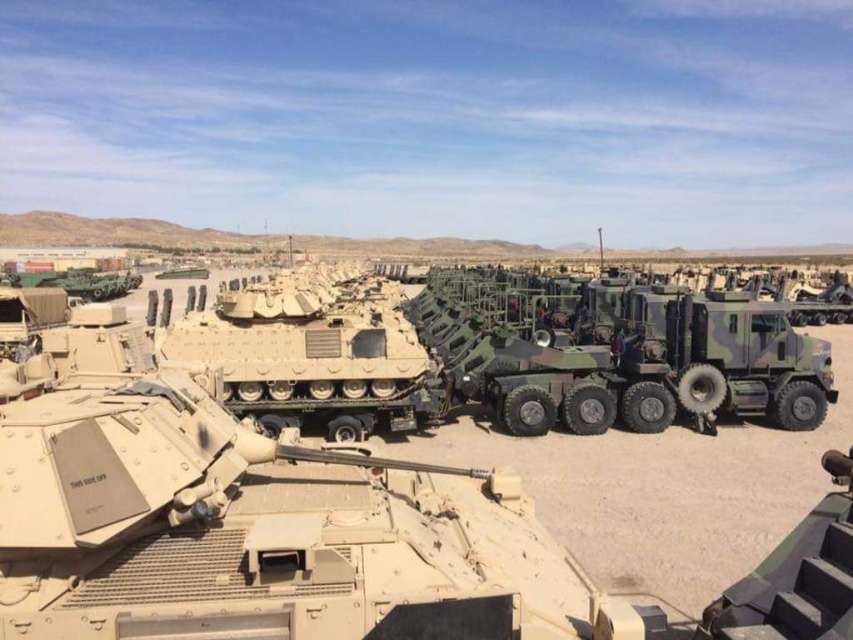
Question: Does tan matte tank at center appear over camouflage textured tank at center?

Choices:
 (A) yes
 (B) no

Answer: (B)

Question: Is tan matte tank at center thinner than camouflage textured tank at center?

Choices:
 (A) yes
 (B) no

Answer: (A)

Question: Can you confirm if tan matte tank at center is smaller than camouflage textured tank at center?

Choices:
 (A) no
 (B) yes

Answer: (B)

Question: Which object is closer to the camera taking this photo?

Choices:
 (A) camouflage textured tank at center
 (B) tan matte tank at center

Answer: (B)